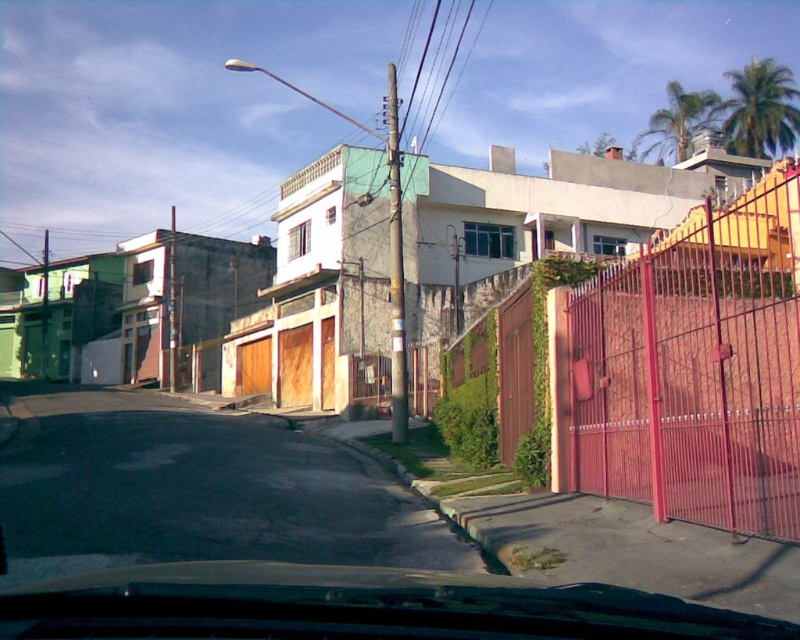
Question: Does metallic red gate at right lie behind asphalt at lower left?

Choices:
 (A) no
 (B) yes

Answer: (A)

Question: Which point appears farthest from the camera in this image?

Choices:
 (A) (772, 260)
 (B) (72, 396)

Answer: (B)

Question: Which point is closer to the camera?

Choices:
 (A) (768, 394)
 (B) (193, 513)

Answer: (A)

Question: Does metallic red gate at right appear over asphalt at lower left?

Choices:
 (A) yes
 (B) no

Answer: (A)

Question: Does metallic red gate at right have a lesser width compared to asphalt at lower left?

Choices:
 (A) no
 (B) yes

Answer: (B)